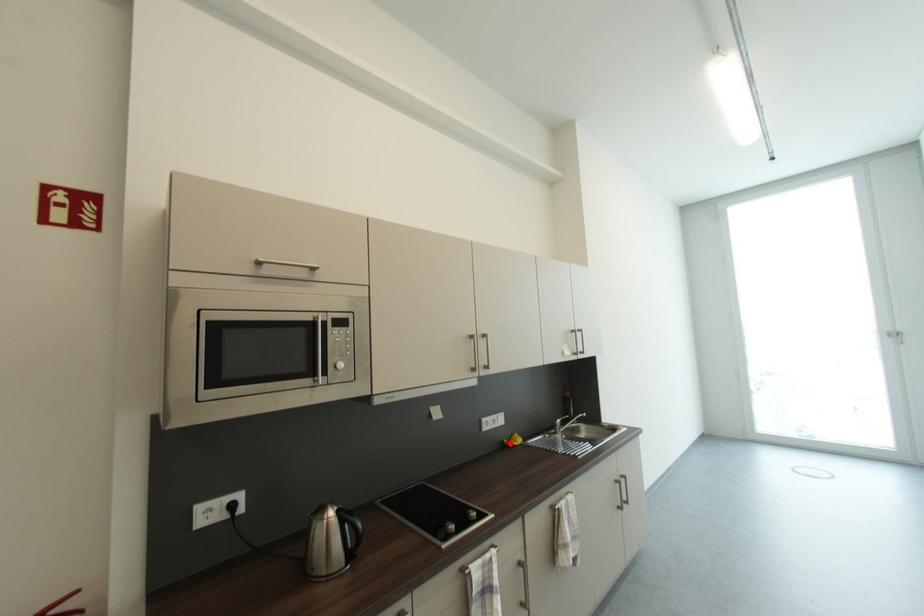
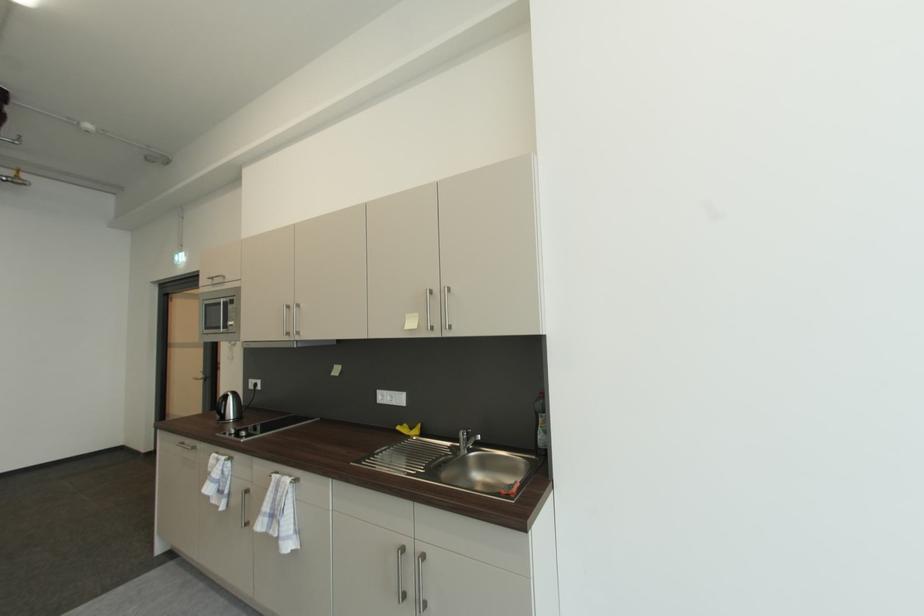
Locate, in the second image, the point that corresponds to the highlighted location in the first image.

(408, 427)